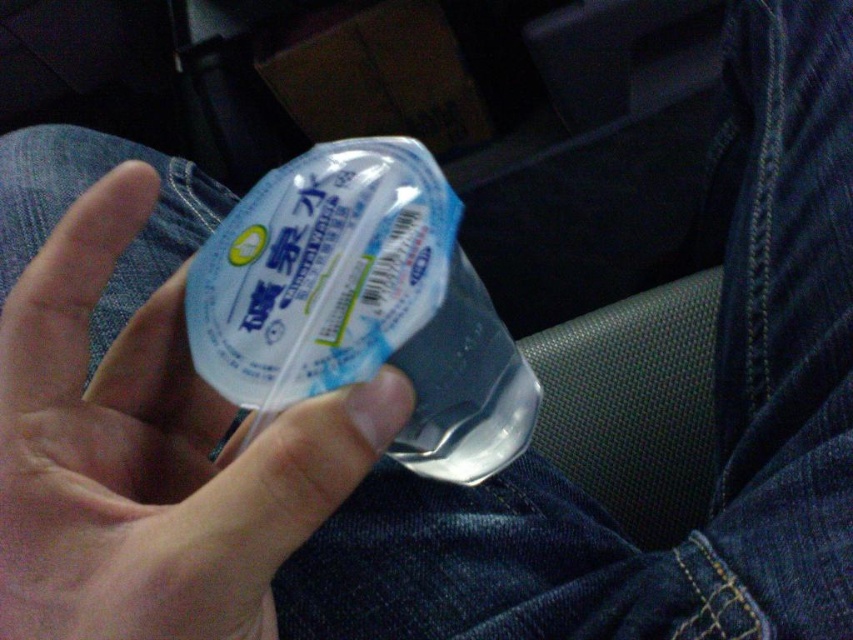
You are a passenger in a car and you want to place the transparent plastic hand at center and the transparent plastic bottle at center on the car seat next to you. Which object will take up more space horizontally?

The transparent plastic bottle at center will take up more space horizontally because it has a greater width than the transparent plastic hand at center.

You are sitting in the backseat of a car and holding a small plastic container. There are two points on the container labeled as point (329, 483) and point (343, 301). Which point is closer to your eyes?

Point (329, 483) is closer to the camera than point (343, 301), so the point closer to your eyes is point (329, 483).